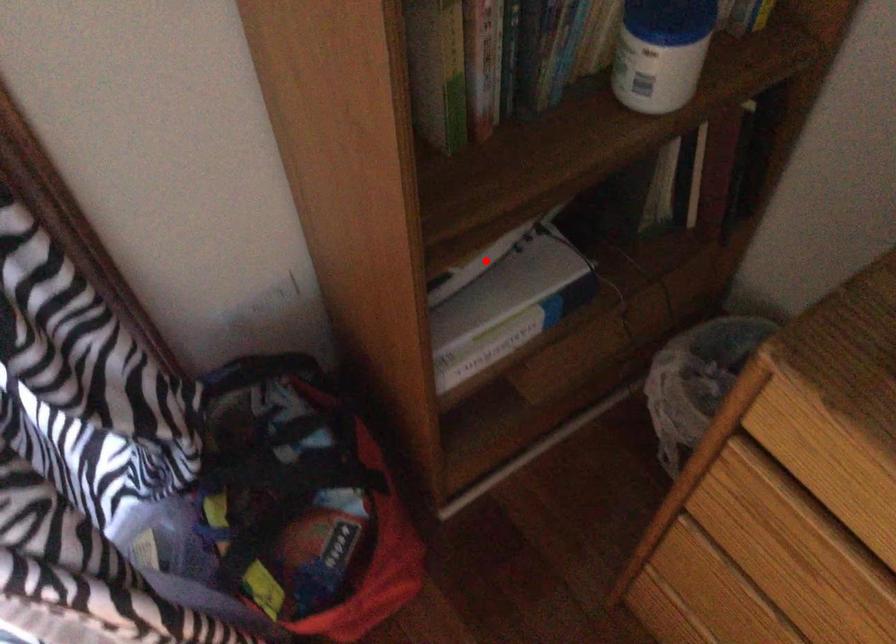
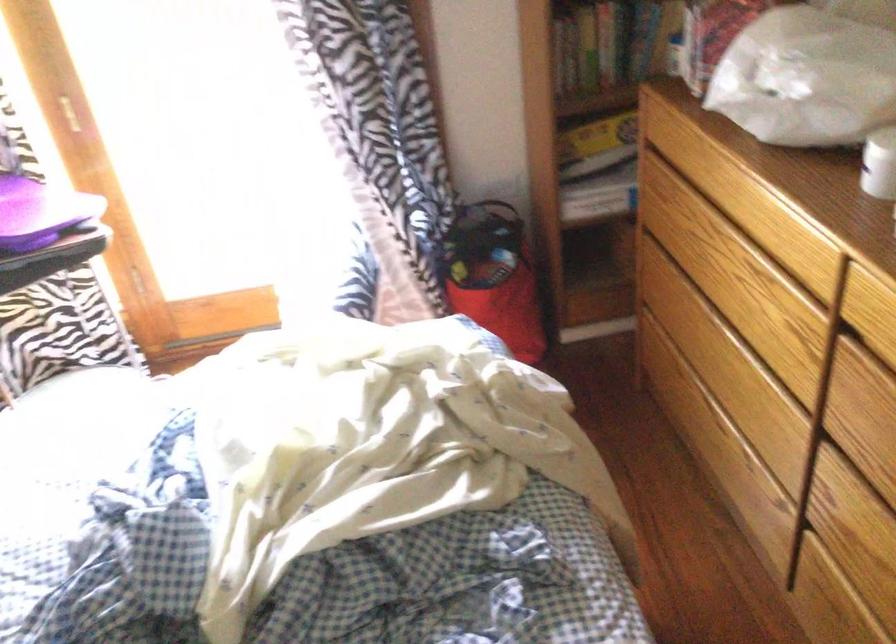
Find the pixel in the second image that matches the highlighted location in the first image.

(597, 136)